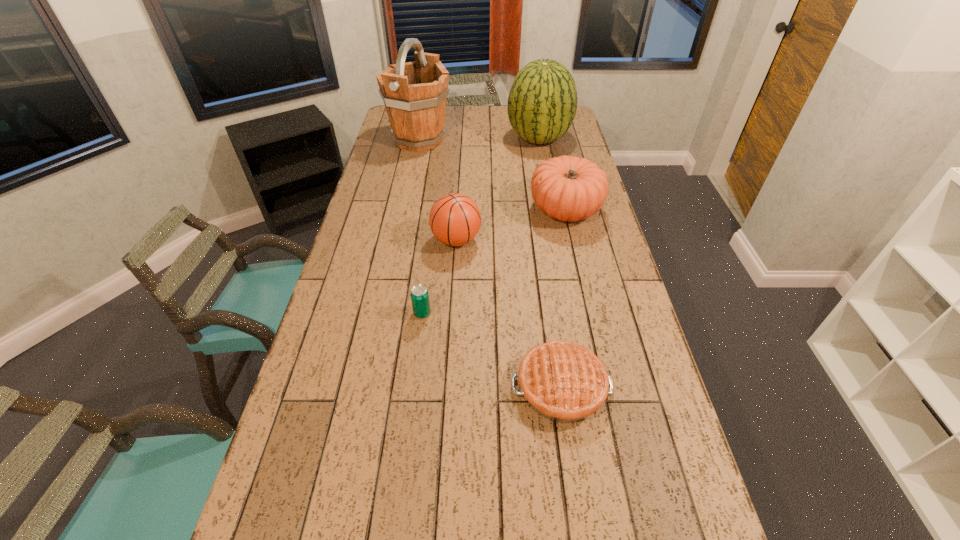
You are a GUI agent. You are given a task and a screenshot of the screen. Output one action in this format:
    pyautogui.click(x=<x>, y=<y>)
    Task: Click on the vacant position located on the left of the beer can
    This screenshot has height=540, width=960.
    Given the screenshot: What is the action you would take?
    pyautogui.click(x=363, y=313)

This screenshot has height=540, width=960. I want to click on vacant area situated 0.050m on the right of the pie, so click(631, 387).

I want to click on bucket at the far edge, so click(x=414, y=93).

Locate an element on the screen. watermelon present at the far edge is located at coordinates (542, 102).

At what (x,y) coordinates should I click in order to perform the action: click on object at the left edge. Please return your answer as a coordinate pair (x, y). The width and height of the screenshot is (960, 540). Looking at the image, I should click on (414, 93).

At what (x,y) coordinates should I click in order to perform the action: click on watermelon present at the right edge. Please return your answer as a coordinate pair (x, y). The width and height of the screenshot is (960, 540). Looking at the image, I should click on (542, 102).

Image resolution: width=960 pixels, height=540 pixels. In order to click on pumpkin situated at the right edge in this screenshot , I will do `click(567, 188)`.

Locate an element on the screen. This screenshot has width=960, height=540. pie that is at the right edge is located at coordinates (564, 382).

You are a GUI agent. You are given a task and a screenshot of the screen. Output one action in this format:
    pyautogui.click(x=<x>, y=<y>)
    Task: Click on the object located at the far left corner
    This screenshot has width=960, height=540.
    Given the screenshot: What is the action you would take?
    pyautogui.click(x=414, y=93)

At what (x,y) coordinates should I click in order to perform the action: click on object that is at the far right corner. Please return your answer as a coordinate pair (x, y). Image resolution: width=960 pixels, height=540 pixels. Looking at the image, I should click on (542, 102).